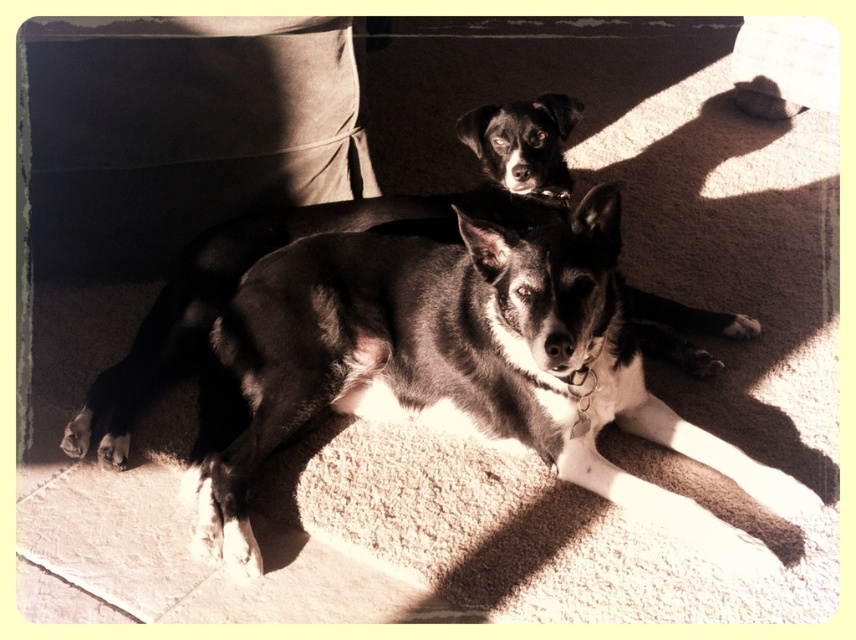
You are standing in front of the two dogs and want to know which point is nearer to you. Which of the two points, point (401, 400) or point (473, 134), is closer to you?

Point (401, 400) is closer to the viewer than point (473, 134).